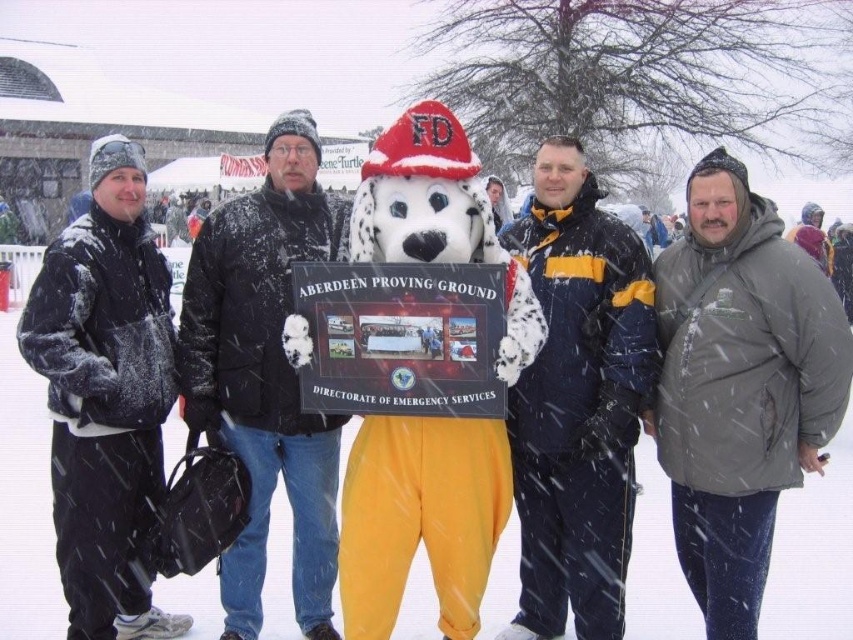
Question: Which of the following is the farthest from the observer?

Choices:
 (A) gray fuzzy jacket at right
 (B) matte black jacket at center

Answer: (B)

Question: Can you confirm if matte black jacket at left is thinner than matte black jacket at center?

Choices:
 (A) yes
 (B) no

Answer: (B)

Question: Which is farther from the matte black jacket at center?

Choices:
 (A) gray fuzzy jacket at right
 (B) navy blue jacket at center

Answer: (A)

Question: Can you confirm if gray fuzzy jacket at right is positioned to the right of matte black jacket at center?

Choices:
 (A) no
 (B) yes

Answer: (B)

Question: Which object is positioned farthest from the matte black jacket at center?

Choices:
 (A) matte black jacket at left
 (B) navy blue jacket at center
 (C) gray fuzzy jacket at right

Answer: (C)

Question: Does navy blue jacket at center have a lesser width compared to matte black jacket at center?

Choices:
 (A) yes
 (B) no

Answer: (A)